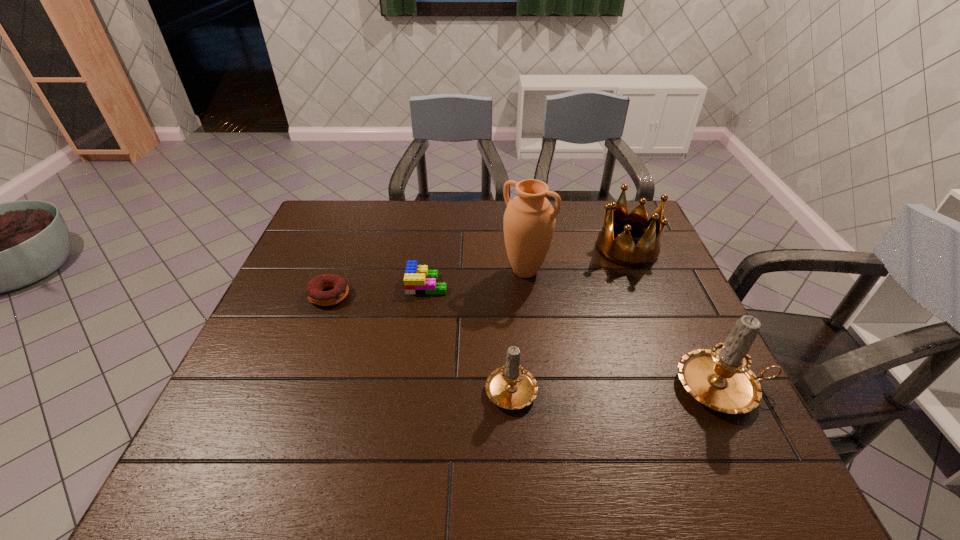
In order to click on the left candle in this screenshot , I will do `click(512, 387)`.

Image resolution: width=960 pixels, height=540 pixels. Identify the location of the third shortest object. (512, 387).

Where is `the right candle`? the right candle is located at coordinates (720, 378).

Where is `the taller candle`? The image size is (960, 540). the taller candle is located at coordinates (720, 378).

Where is `the second object from left to right`? the second object from left to right is located at coordinates (418, 279).

At what (x,y) coordinates should I click in order to perform the action: click on Lego. Please return your answer as a coordinate pair (x, y). Looking at the image, I should click on (418, 279).

Find the location of `crown`. crown is located at coordinates (621, 251).

Find the location of a particular element. the tallest object is located at coordinates (529, 220).

Where is `the shortest object`? the shortest object is located at coordinates (340, 290).

Identify the location of doughnut. (340, 290).